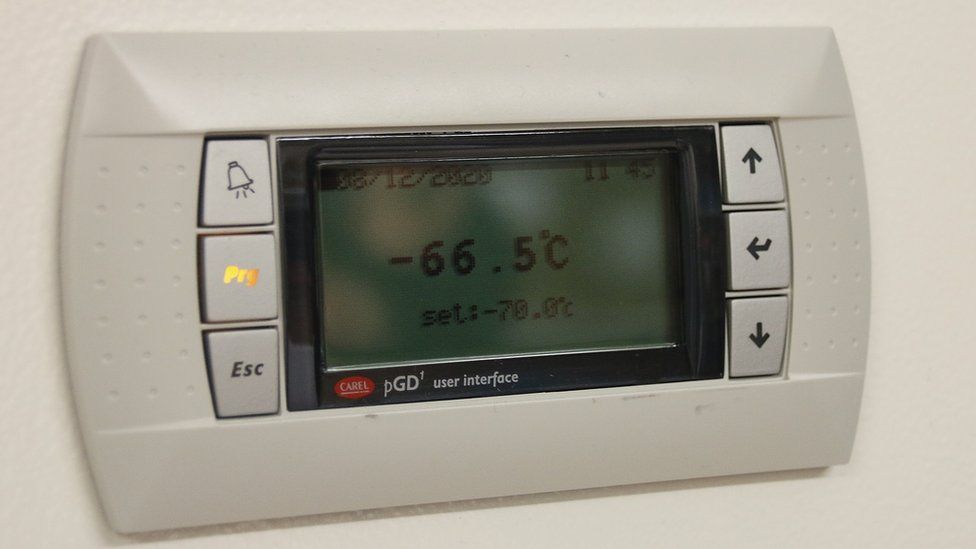
This screenshot has height=549, width=976. What are the coordinates of `thermostat` in the screenshot? It's located at (441, 65).